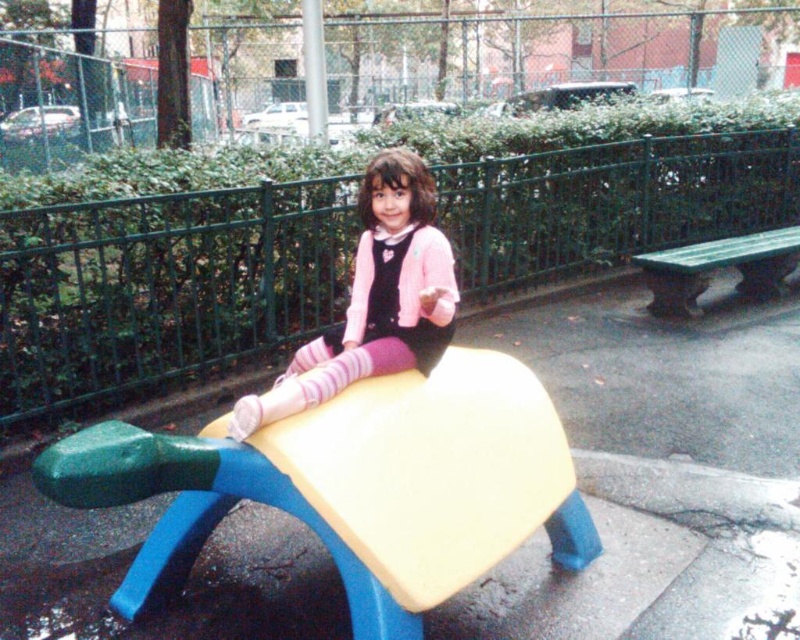
Based on the photo, you are a photographer setting up a shot of the girl on the playground horse structure. You need to ensure that both the pink matte sweater at center and the green plastic bench at right are visible in the frame. Based on their sizes, which object will appear larger in the photo?

The pink matte sweater at center will appear larger in the photo because it is much taller than the green plastic bench at right.

Consider the image. You are a parent looking for a place to sit while watching your child play on the horse structure. You see the pink matte sweater at center and the green plastic bench at right. Which object can you sit on?

The green plastic bench at right is the object you can sit on, as the pink matte sweater at center is positioned under it and likely belongs to the child.